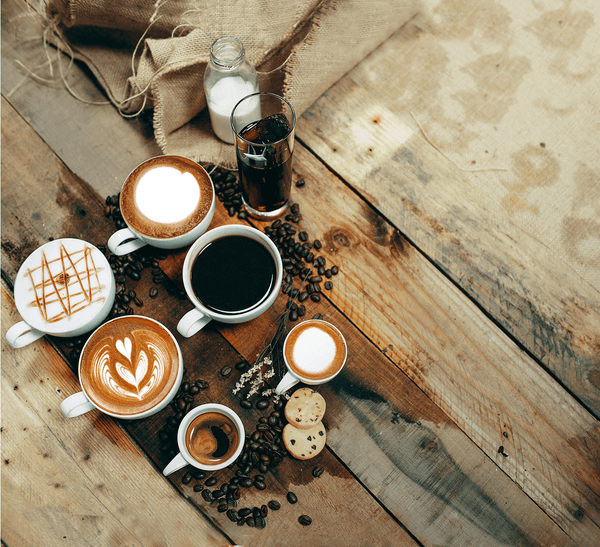
Find the location of a particular element. mug handles is located at coordinates (73, 401), (26, 343), (118, 238), (188, 324), (288, 385), (173, 463).